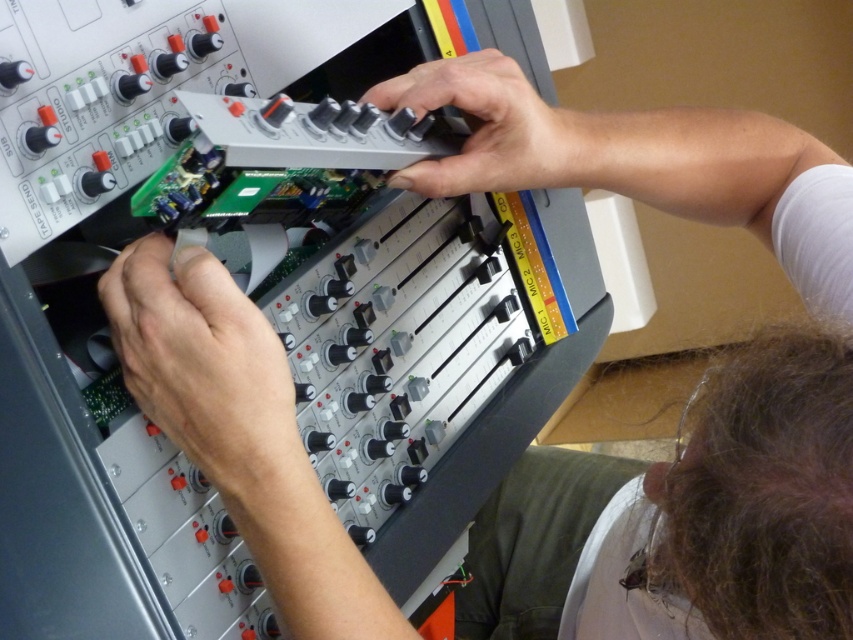
You are an audio technician working on a mixing console. You need to replace the matte black circuit board at lower left and the metallic gray control panel at center. Which component requires a taller replacement part?

The matte black circuit board at lower left requires a taller replacement part because it is much taller than the metallic gray control panel at center.

You are an audio technician trying to access the metallic gray control panel at center to adjust a knob. However, the matte black circuit board at lower left is blocking your view. Can you move the circuit board to the side to access the control panel?

The matte black circuit board at lower left is in front of the metallic gray control panel at center, so you can move it aside to access the control panel.